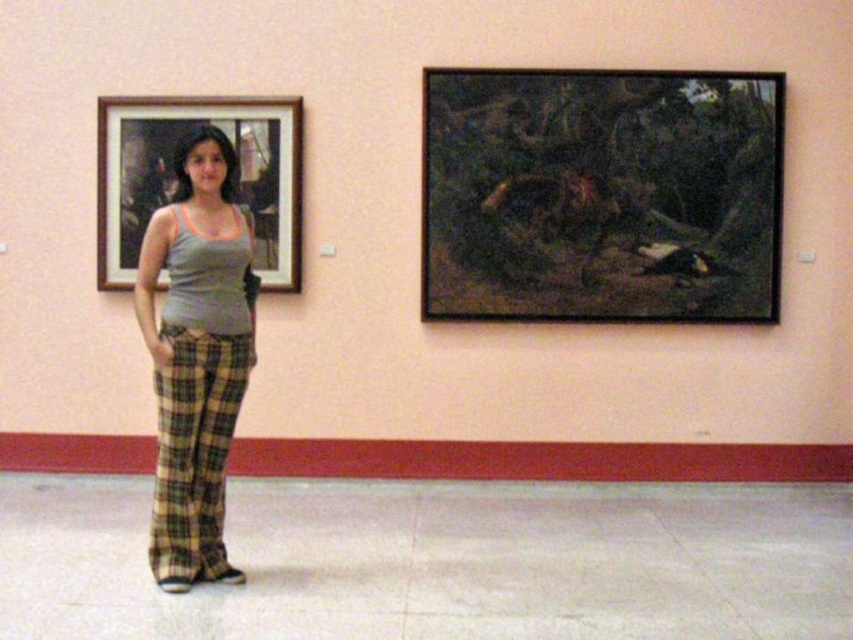
You are an art curator standing in the gallery. You notice the dark brown wooden picture frame at upper right and the wooden framed portrait at left. Which one is closer to you?

The dark brown wooden picture frame at upper right is closer to you because it is in front of the wooden framed portrait at left.

You are an art student who wants to hang a new painting on the wall between the matte gray tank top at center and the wooden framed portrait at left. Which side should you choose to ensure the new painting won t block the existing artwork?

The matte gray tank top at center is thinner than the wooden framed portrait at left, so you should place the new painting on the side of the wooden framed portrait at left since it is wider and less likely to block the existing artwork.